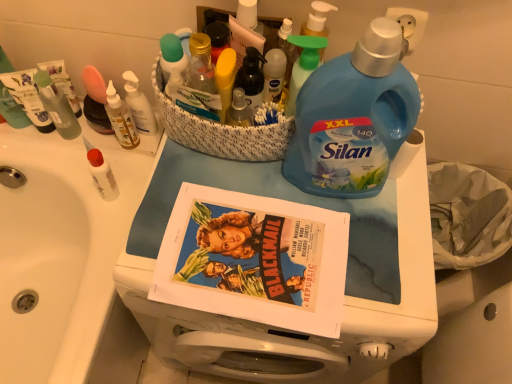
Find the location of a particular element. vacant region in front of white matte bottle at left, the 4th toiletry viewed from the right is located at coordinates (104, 244).